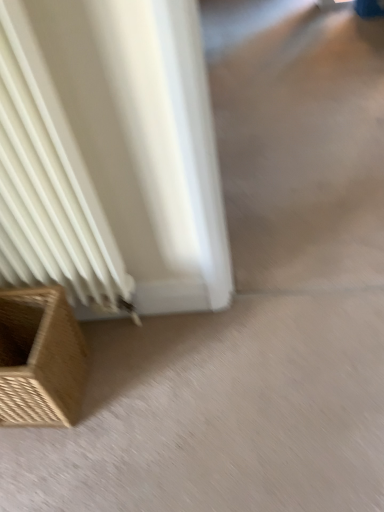
Question: Is beige carpet at lower left bigger than brown woven basket at lower left?

Choices:
 (A) no
 (B) yes

Answer: (A)

Question: Is beige carpet at lower left smaller than brown woven basket at lower left?

Choices:
 (A) no
 (B) yes

Answer: (B)

Question: Is beige carpet at lower left at the left side of brown woven basket at lower left?

Choices:
 (A) no
 (B) yes

Answer: (A)

Question: From the image's perspective, is beige carpet at lower left under brown woven basket at lower left?

Choices:
 (A) yes
 (B) no

Answer: (A)

Question: Is beige carpet at lower left not inside brown woven basket at lower left?

Choices:
 (A) yes
 (B) no

Answer: (A)

Question: Is beige carpet at lower left taller than brown woven basket at lower left?

Choices:
 (A) yes
 (B) no

Answer: (B)

Question: Considering the relative positions of brown woven basket at lower left and beige carpet at lower left in the image provided, is brown woven basket at lower left behind beige carpet at lower left?

Choices:
 (A) yes
 (B) no

Answer: (B)

Question: Is brown woven basket at lower left outside of beige carpet at lower left?

Choices:
 (A) no
 (B) yes

Answer: (B)

Question: Is brown woven basket at lower left to the right of beige carpet at lower left from the viewer's perspective?

Choices:
 (A) no
 (B) yes

Answer: (A)

Question: From the image's perspective, would you say brown woven basket at lower left is shown under beige carpet at lower left?

Choices:
 (A) no
 (B) yes

Answer: (A)

Question: Is brown woven basket at lower left facing away from beige carpet at lower left?

Choices:
 (A) no
 (B) yes

Answer: (A)

Question: Is beige carpet at lower left completely or partially inside brown woven basket at lower left?

Choices:
 (A) no
 (B) yes

Answer: (A)

Question: Considering the positions of brown woven basket at lower left and beige carpet at lower left in the image, is brown woven basket at lower left taller or shorter than beige carpet at lower left?

Choices:
 (A) short
 (B) tall

Answer: (B)